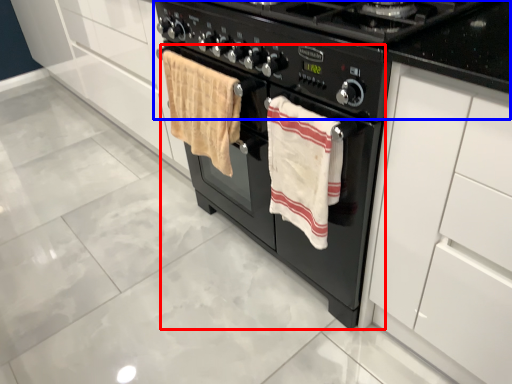
Question: Which point is further to the camera, oven (highlighted by a red box) or gas stove (highlighted by a blue box)?

Choices:
 (A) oven
 (B) gas stove

Answer: (A)